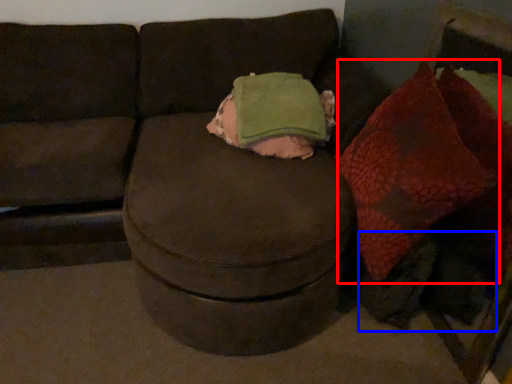
Question: Which object is further to the camera taking this photo, bean bag chair (highlighted by a red box) or animal (highlighted by a blue box)?

Choices:
 (A) bean bag chair
 (B) animal

Answer: (B)